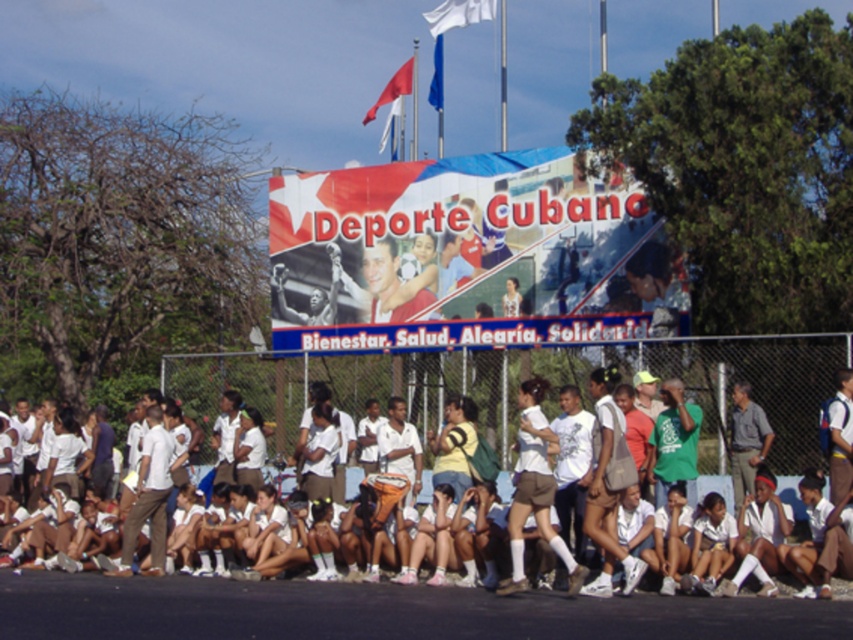
Does white cotton shirt at center appear on the right side of blue fabric flag at upper center?

No, white cotton shirt at center is not to the right of blue fabric flag at upper center.

Who is shorter, white cotton shirt at center or blue fabric flag at upper center?

With less height is white cotton shirt at center.

Where is `white cotton shirt at center`? The height and width of the screenshot is (640, 853). white cotton shirt at center is located at coordinates (796, 396).

Is point (811, 380) positioned before point (459, 6)?

That is True.

Which is in front, point (694, 429) or point (432, 35)?

Point (694, 429) is in front.

The image size is (853, 640). Describe the element at coordinates (796, 396) in the screenshot. I see `white cotton shirt at center` at that location.

The width and height of the screenshot is (853, 640). I want to click on white cotton shirt at center, so click(796, 396).

Which of these two, matte plastic banner at center or gray shirt at center, stands taller?

Standing taller between the two is matte plastic banner at center.

Can you confirm if matte plastic banner at center is positioned above gray shirt at center?

Indeed, matte plastic banner at center is positioned over gray shirt at center.

Find the location of a particular element. matte plastic banner at center is located at coordinates (461, 253).